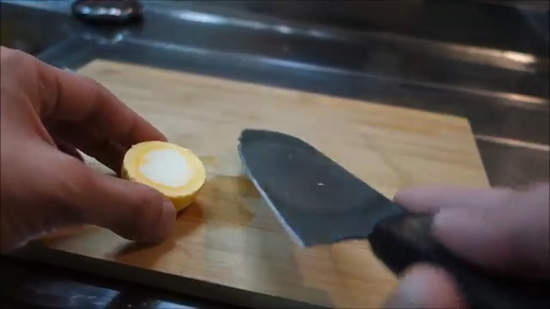
Identify the location of wooden cutting board. The image size is (550, 309). (409, 147).